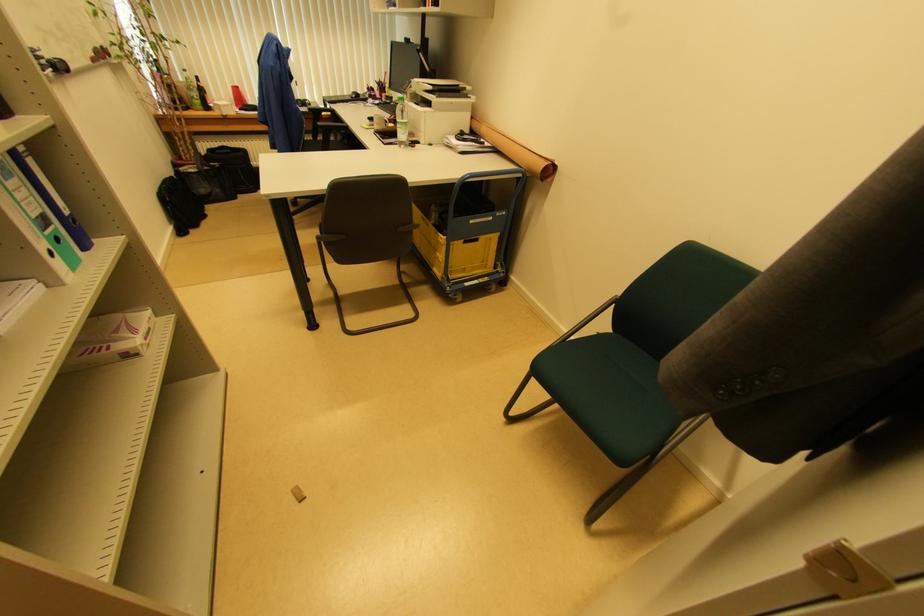
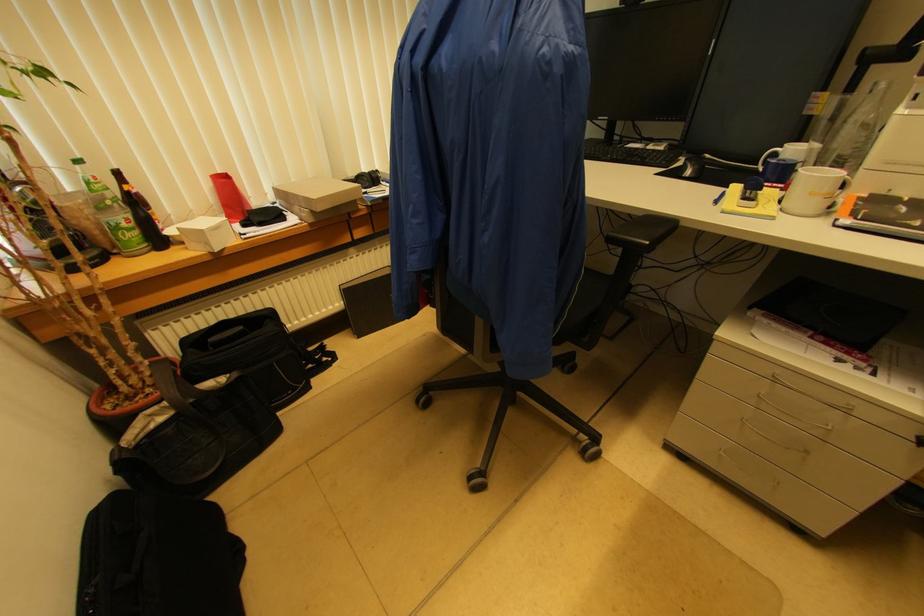
Locate, in the second image, the point that corresponds to the point at 200,98 in the first image.

(131, 219)